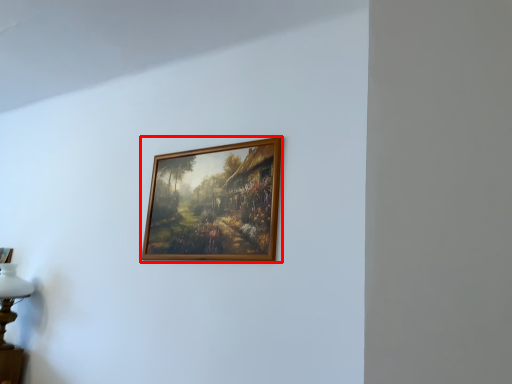
Question: From the image's perspective, what is the correct spatial positioning of picture frame (annotated by the red box) in reference to table lamp?

Choices:
 (A) above
 (B) below

Answer: (A)